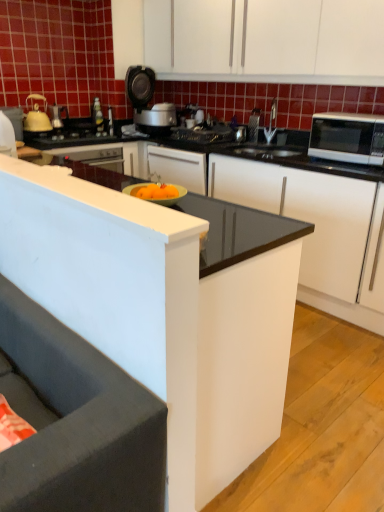
Question: Looking at the image, does white glossy microwave at right seem bigger or smaller compared to dark gray fabric studio couch at lower left?

Choices:
 (A) big
 (B) small

Answer: (B)

Question: Visually, is white glossy microwave at right positioned to the left or to the right of dark gray fabric studio couch at lower left?

Choices:
 (A) left
 (B) right

Answer: (B)

Question: Which of these objects is positioned closest to the matte yellow tea pot at left?

Choices:
 (A) white glossy microwave at right
 (B) metallic silver toaster at upper center
 (C) white matte cabinet at upper center, acting as the 1th cabinetry starting from the top
 (D) black glossy counter at center
 (E) dark gray fabric studio couch at lower left

Answer: (C)

Question: Considering the real-world distances, which object is farthest from the white matte cabinet at upper center, acting as the 1th cabinetry starting from the top?

Choices:
 (A) dark gray fabric studio couch at lower left
 (B) black matte gas stove at center
 (C) metallic silver toaster at upper center
 (D) matte yellow tea pot at left
 (E) black glossy counter at center

Answer: (A)